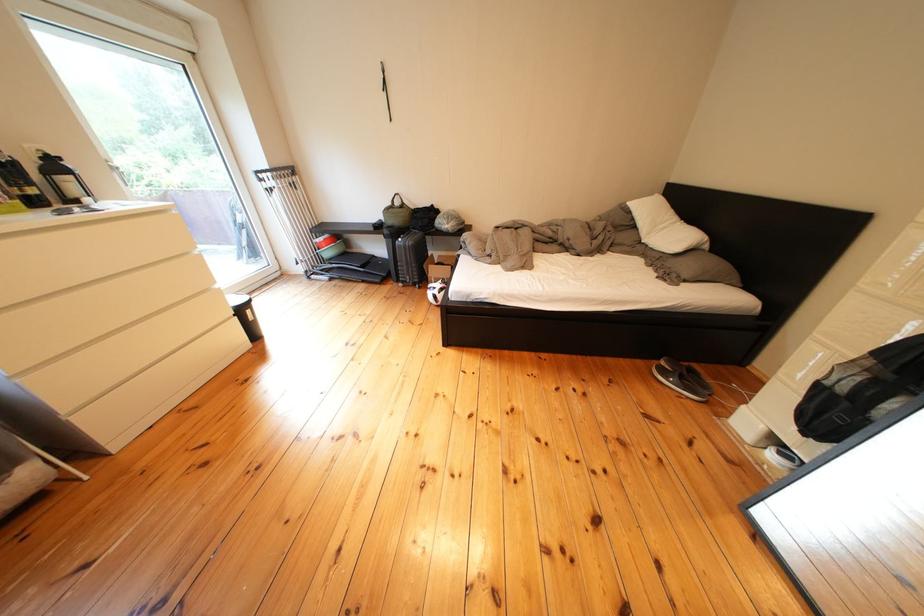
Find where to lift the white pillow. Please return your answer as a coordinate pair (x, y).

(664, 225)